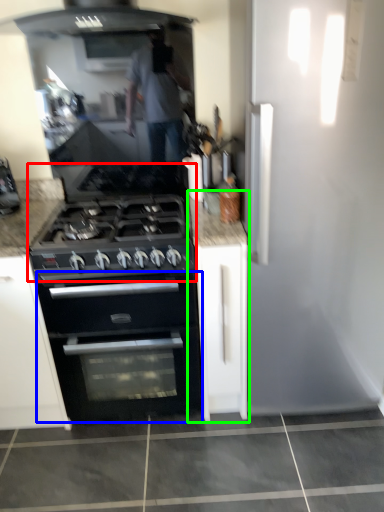
Question: Which object is positioned farthest from gas stove (highlighted by a red box)? Select from oven (highlighted by a blue box) and cabinetry (highlighted by a green box).

Choices:
 (A) oven
 (B) cabinetry

Answer: (A)